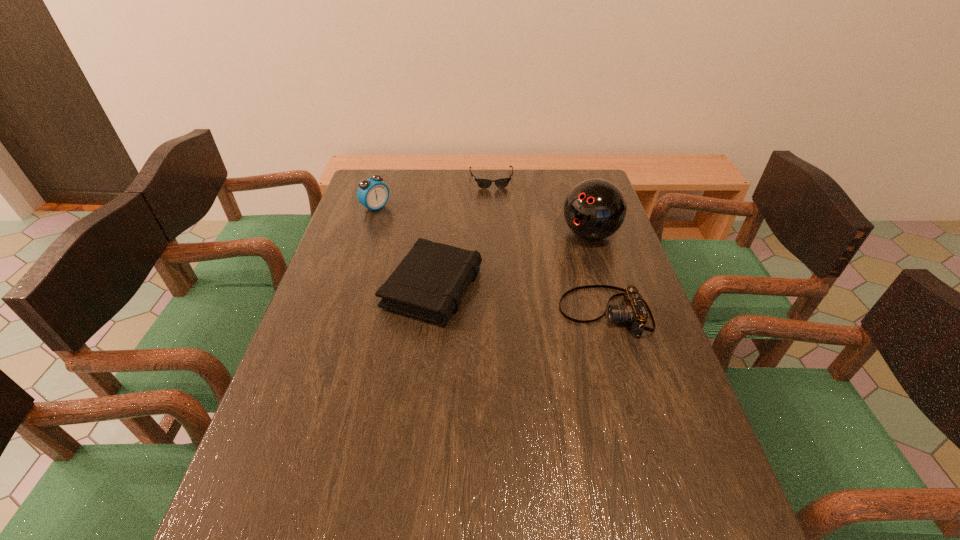
At what (x,y) coordinates should I click in order to perform the action: click on vacant space located on the front-facing side of the camera. Please return your answer as a coordinate pair (x, y). The image size is (960, 540). Looking at the image, I should click on (480, 312).

You are a GUI agent. You are given a task and a screenshot of the screen. Output one action in this format:
    pyautogui.click(x=<x>, y=<y>)
    Task: Click on the free space located 0.060m on the front-facing side of the camera
    This screenshot has width=960, height=540.
    Given the screenshot: What is the action you would take?
    pyautogui.click(x=537, y=312)

Where is `free space located on the surface of the tallest object near the finger holes`? Image resolution: width=960 pixels, height=540 pixels. free space located on the surface of the tallest object near the finger holes is located at coordinates (494, 305).

Locate an element on the screen. Image resolution: width=960 pixels, height=540 pixels. free space located on the surface of the tallest object near the finger holes is located at coordinates (499, 301).

This screenshot has width=960, height=540. I want to click on free space located on the surface of the tallest object near the finger holes, so click(518, 286).

Locate an element on the screen. The height and width of the screenshot is (540, 960). vacant point located on the front-facing side of the farthest object is located at coordinates (501, 245).

Where is `vacant space located on the front-facing side of the farthest object`? vacant space located on the front-facing side of the farthest object is located at coordinates (500, 237).

Find the location of `vacant space located on the front-facing side of the farthest object`. vacant space located on the front-facing side of the farthest object is located at coordinates (495, 205).

At what (x,y) coordinates should I click in order to perform the action: click on free point located on the face of the second tallest object. Please return your answer as a coordinate pair (x, y). This screenshot has width=960, height=540. Looking at the image, I should click on (451, 255).

Identify the location of vacant area situated on the face of the second tallest object. The image size is (960, 540). (394, 219).